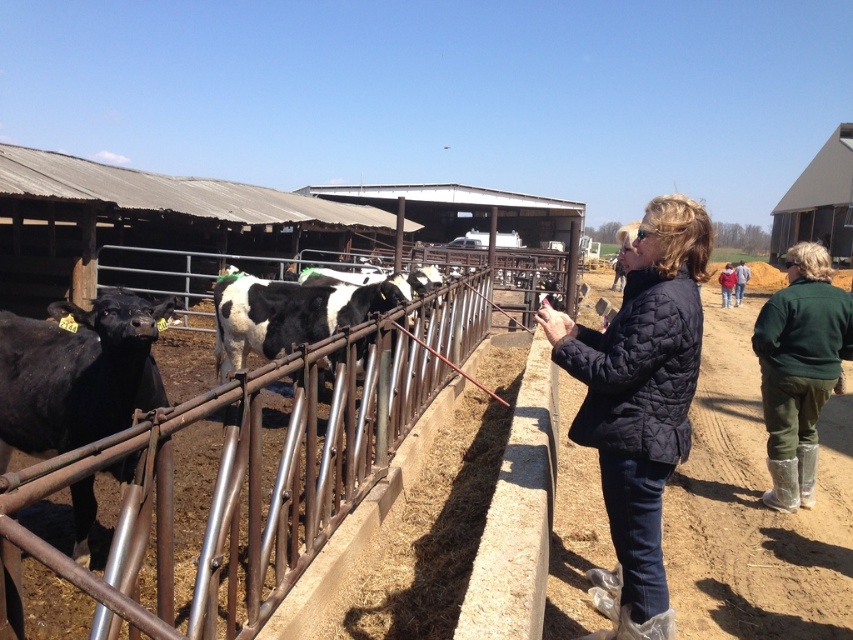
You are a farmer standing in the field and want to hand the red object to the person in the green fabric jacket at center. Which direction should you move towards relative to the brushed metal fence at center?

The brushed metal fence at center is positioned on the left side of green fabric jacket at center, so you should move towards the right side of the brushed metal fence at center to reach the green fabric jacket at center.

You are a farmer standing at the origin point of the farm image. You need to locate the quilted navy jacket at center. In which direction should you move relative to your current position to reach it?

The quilted navy jacket at center is located at point (640, 400). Since you are at the origin, you should move towards the northeast direction to reach it.

You are a farmer who needs to determine if the brushed metal fence at center can block the view of the green fabric jacket at center from the cows. Based on their heights, can the cows see the jacket?

The brushed metal fence at center is not as tall as the green fabric jacket at center, so the cows might still be able to see the jacket over the fence.